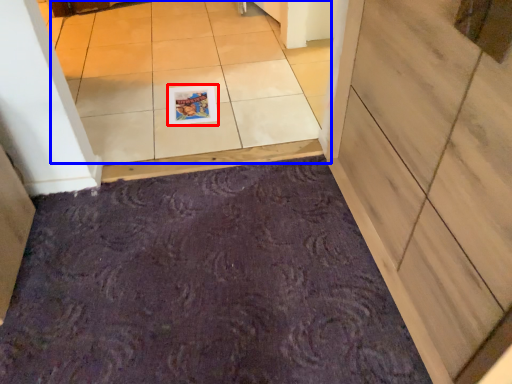
Question: Which point is further to the camera, postcard (highlighted by a red box) or tile (highlighted by a blue box)?

Choices:
 (A) postcard
 (B) tile

Answer: (A)